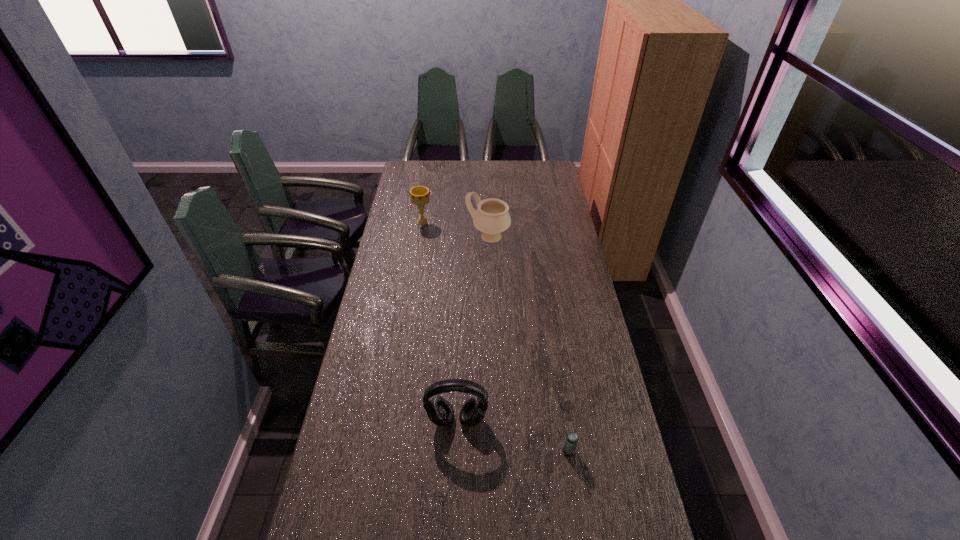
Locate an element on the screen. This screenshot has height=540, width=960. object present at the right edge is located at coordinates (571, 440).

In the image, there is a desktop. Identify the location of free space at the far edge. click(x=474, y=174).

The width and height of the screenshot is (960, 540). What are the coordinates of `vacant space at the left edge of the desktop` in the screenshot? It's located at (372, 323).

You are a GUI agent. You are given a task and a screenshot of the screen. Output one action in this format:
    pyautogui.click(x=<x>, y=<y>)
    Task: Click on the vacant space at the right edge of the desktop
    Image resolution: width=960 pixels, height=540 pixels.
    Given the screenshot: What is the action you would take?
    600,348

I want to click on free space between the pottery and the headset, so click(x=472, y=328).

Locate an element on the screen. free spot between the headset and the chalice is located at coordinates (440, 321).

Where is `vacant area between the second nearest object and the pottery`? vacant area between the second nearest object and the pottery is located at coordinates (472, 328).

Find the location of `free space between the pottery and the leftmost object`. free space between the pottery and the leftmost object is located at coordinates (455, 230).

At what (x,y) coordinates should I click in order to perform the action: click on vacant area that lies between the pottery and the chalice. Please return your answer as a coordinate pair (x, y). Looking at the image, I should click on (455, 230).

Locate an element on the screen. Image resolution: width=960 pixels, height=540 pixels. free spot between the third farthest object and the rightmost object is located at coordinates (513, 436).